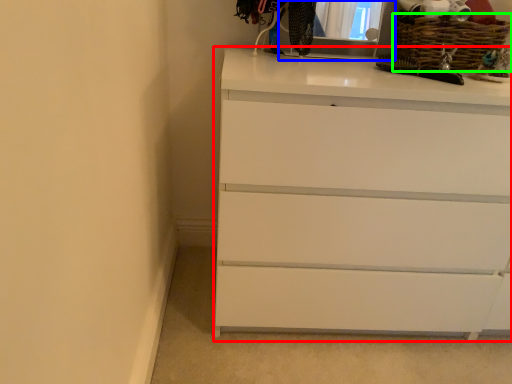
Question: Which is nearer to the chest of drawers (highlighted by a red box)? medicine cabinet (highlighted by a blue box) or basket (highlighted by a green box).

Choices:
 (A) medicine cabinet
 (B) basket

Answer: (B)